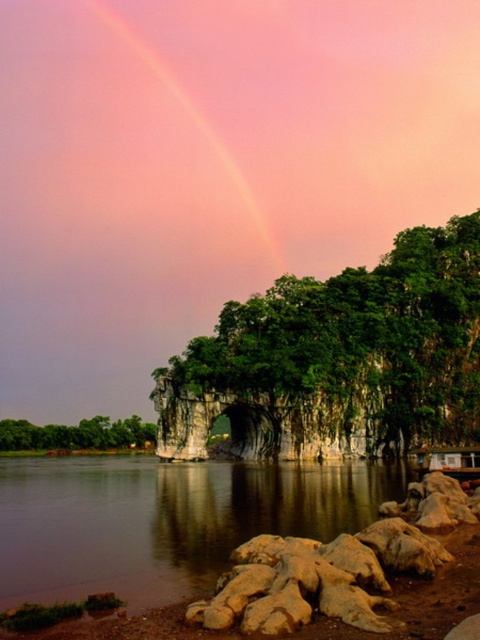
Question: Is green leafy tree at center further to the viewer compared to green leafy tree at lower left?

Choices:
 (A) yes
 (B) no

Answer: (B)

Question: Can you confirm if smooth brown water at lower center is wider than green leafy tree at lower left?

Choices:
 (A) yes
 (B) no

Answer: (A)

Question: Among these objects, which one is farthest from the camera?

Choices:
 (A) rustic stone boulder at lower right
 (B) green leafy tree at lower left
 (C) pink translucent rainbow at upper center

Answer: (C)

Question: Is smooth brown water at lower center closer to camera compared to green leafy tree at lower left?

Choices:
 (A) yes
 (B) no

Answer: (A)

Question: Which is farther from the green leafy tree at lower left?

Choices:
 (A) rustic stone boulder at lower right
 (B) green leafy tree at center

Answer: (A)

Question: Which point appears closest to the camera in this image?

Choices:
 (A) (360, 564)
 (B) (187, 92)

Answer: (A)